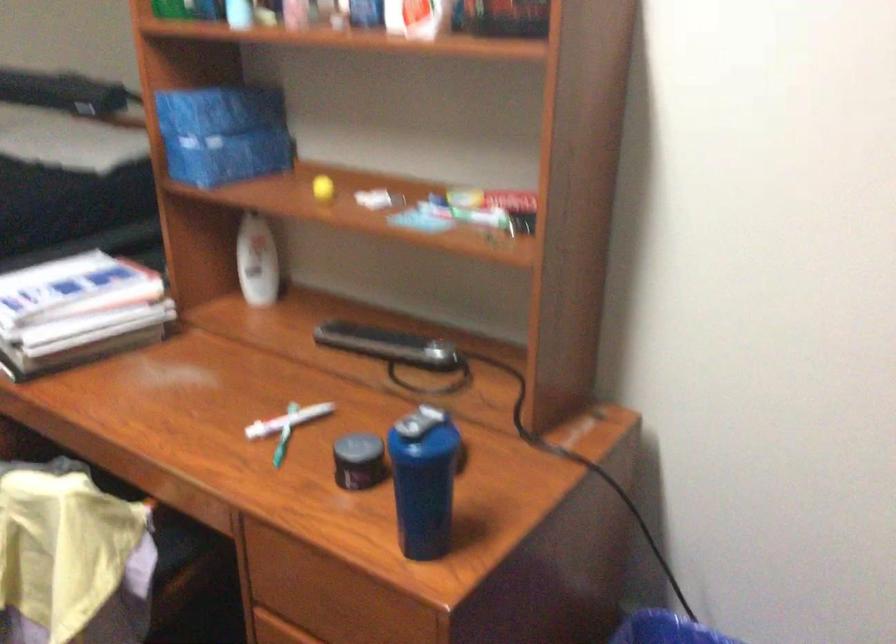
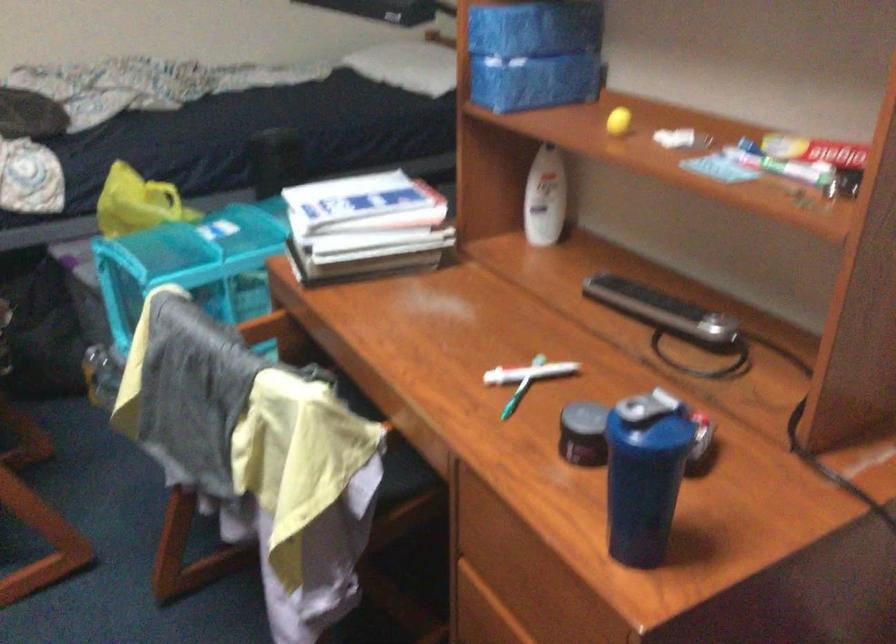
In the second image, find the point that corresponds to (358,464) in the first image.

(584, 433)